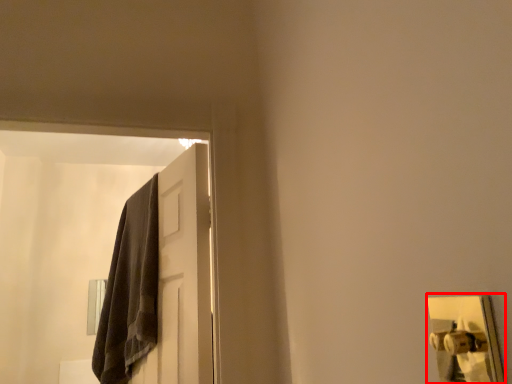
Question: Observing the image, what is the correct spatial positioning of door handle (annotated by the red box) in reference to door?

Choices:
 (A) right
 (B) left

Answer: (A)